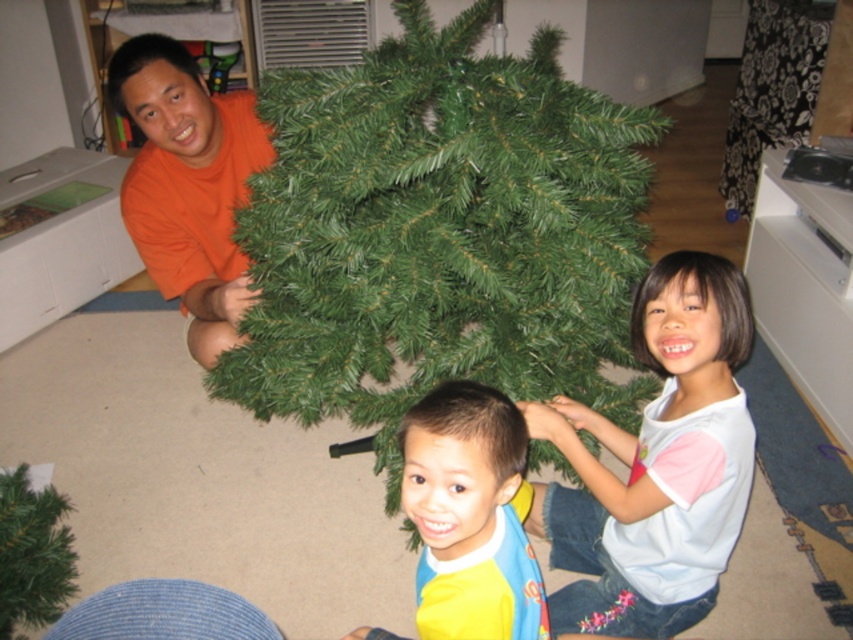
Is white cotton shirt at center to the left of orange matte shirt at left from the viewer's perspective?

Incorrect, white cotton shirt at center is not on the left side of orange matte shirt at left.

Between white cotton shirt at center and orange matte shirt at left, which one has more height?

With more height is orange matte shirt at left.

What do you see at coordinates (656, 465) in the screenshot? The width and height of the screenshot is (853, 640). I see `white cotton shirt at center` at bounding box center [656, 465].

Where is `white cotton shirt at center`? This screenshot has height=640, width=853. white cotton shirt at center is located at coordinates (656, 465).

Is green artificial christmas tree at center taller than yellow fabric bib at center?

Indeed, green artificial christmas tree at center has a greater height compared to yellow fabric bib at center.

Looking at this image, can you confirm if green artificial christmas tree at center is wider than yellow fabric bib at center?

Indeed, green artificial christmas tree at center has a greater width compared to yellow fabric bib at center.

Between point (416, 378) and point (431, 509), which one is positioned behind?

The point (416, 378) is more distant.

You are a GUI agent. You are given a task and a screenshot of the screen. Output one action in this format:
    pyautogui.click(x=<x>, y=<y>)
    Task: Click on the green artificial christmas tree at center
    Image resolution: width=853 pixels, height=640 pixels.
    Given the screenshot: What is the action you would take?
    pyautogui.click(x=439, y=232)

Between point (202, 353) and point (354, 634), which one is positioned in front?

Point (354, 634) is more forward.

Is point (178, 180) farther from viewer compared to point (461, 444)?

That is True.

Where is `orange matte shirt at left`? This screenshot has height=640, width=853. orange matte shirt at left is located at coordinates (189, 184).